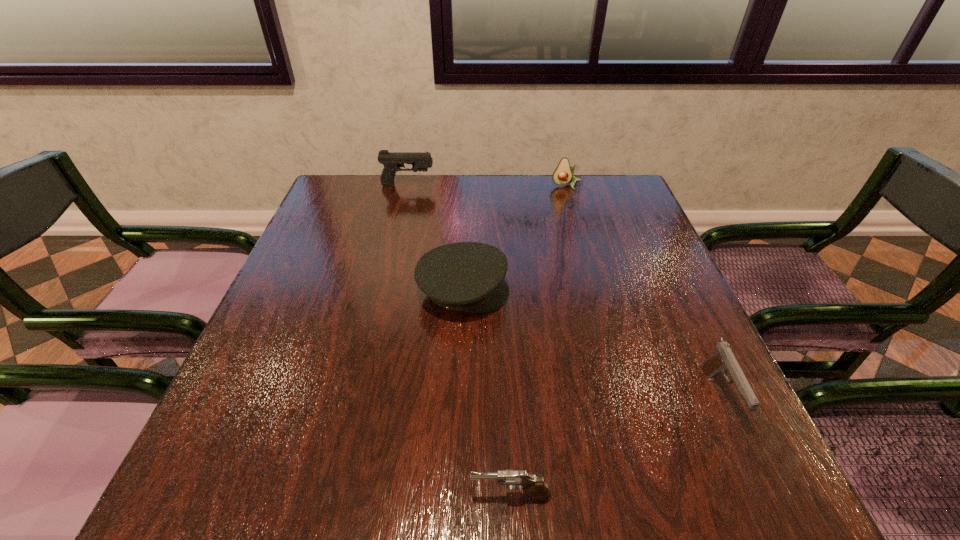
What are the coordinates of `the third closest object relative to the second tallest pistol` in the screenshot? It's located at (563, 174).

This screenshot has height=540, width=960. I want to click on object that stands as the second closest to the beret, so click(x=392, y=161).

The width and height of the screenshot is (960, 540). What are the coordinates of `the second closest pistol to the avocado` in the screenshot? It's located at (723, 360).

Locate which pistol is the second closest to the farthest pistol. Please provide its 2D coordinates. Your answer should be formatted as a tuple, i.e. [(x, y)], where the tuple contains the x and y coordinates of a point satisfying the conditions above.

[(514, 479)]

The height and width of the screenshot is (540, 960). I want to click on free space that satisfies the following two spatial constraints: 1. at the barrel of the rightmost pistol; 2. at the barrel of the shortest object, so click(765, 496).

At what (x,y) coordinates should I click in order to perform the action: click on free space that satisfies the following two spatial constraints: 1. on the seed side of the avocado; 2. at the barrel of the shortest pistol. Please return your answer as a coordinate pair (x, y). Looking at the image, I should click on (654, 496).

Locate an element on the screen. vacant space that satisfies the following two spatial constraints: 1. on the seed side of the avocado; 2. on the front-facing side of the beret is located at coordinates (596, 292).

You are a GUI agent. You are given a task and a screenshot of the screen. Output one action in this format:
    pyautogui.click(x=<x>, y=<y>)
    Task: Click on the vacant area that satisfies the following two spatial constraints: 1. on the seed side of the avocado; 2. on the front-facing side of the third nearest object
    The height and width of the screenshot is (540, 960).
    Given the screenshot: What is the action you would take?
    pyautogui.click(x=596, y=292)

The width and height of the screenshot is (960, 540). I want to click on vacant space that satisfies the following two spatial constraints: 1. on the seed side of the avocado; 2. at the barrel of the second pistol from left to right, so click(x=654, y=496).

You are a GUI agent. You are given a task and a screenshot of the screen. Output one action in this format:
    pyautogui.click(x=<x>, y=<y>)
    Task: Click on the free location that satisfies the following two spatial constraints: 1. on the seed side of the avocado; 2. at the barrel of the shortest object
    The width and height of the screenshot is (960, 540).
    Given the screenshot: What is the action you would take?
    pyautogui.click(x=654, y=496)